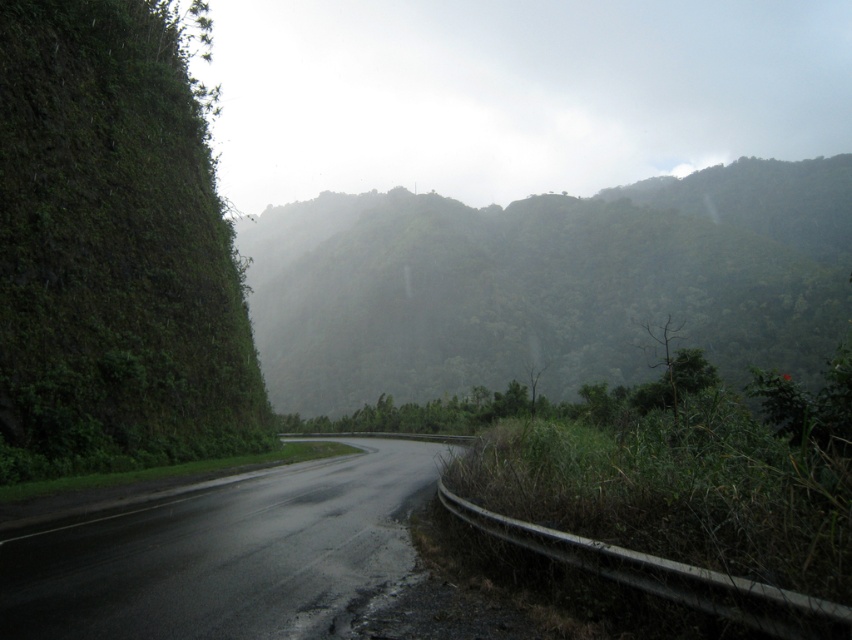
You are a hiker planning to take a photo of the green leafy mountain at center and the black asphalt road at center. Which object will appear larger in your camera viewfinder?

The green leafy mountain at center will appear larger in your camera viewfinder because it is bigger than the black asphalt road at center.

You are a hiker planning to take a photo of the green leafy mountain at center and the black asphalt road at center. Which object should you focus on first if you want to capture both in one frame without moving the camera?

The green leafy mountain at center is positioned on the right side of the black asphalt road at center, so you should focus on the black asphalt road at center first to ensure both are in the frame.